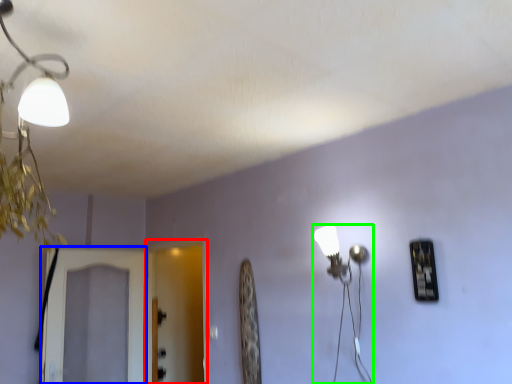
Question: Which object is the farthest from screen door (highlighted by a red box)? Choose among these: screen door (highlighted by a blue box) or lamp (highlighted by a green box).

Choices:
 (A) screen door
 (B) lamp

Answer: (B)